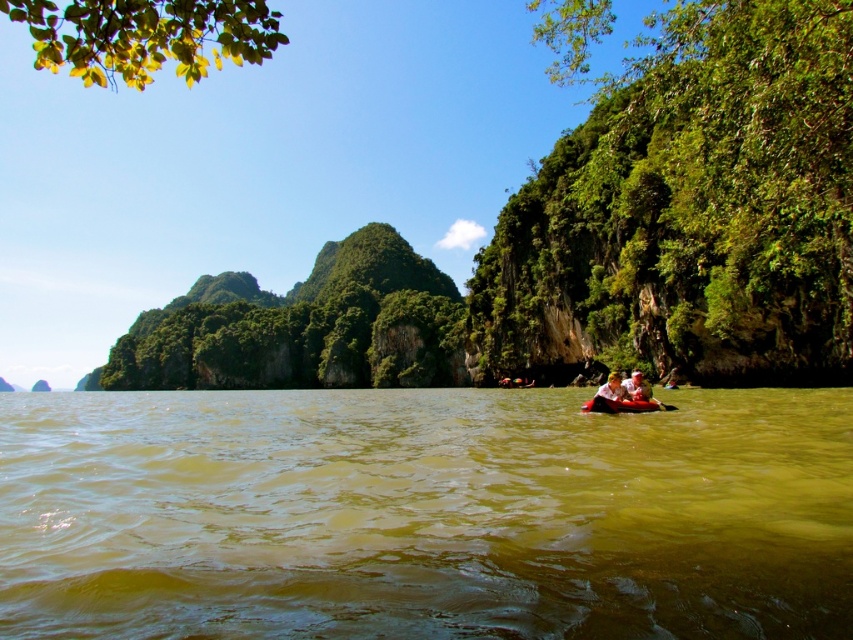
Can you confirm if white cotton shirt at lower right is bigger than smooth red kayak at center?

Actually, white cotton shirt at lower right might be smaller than smooth red kayak at center.

Which is more to the left, white cotton shirt at lower right or smooth red kayak at center?

smooth red kayak at center

Is point (636, 397) more distant than point (606, 388)?

No, (636, 397) is in front of (606, 388).

You are a GUI agent. You are given a task and a screenshot of the screen. Output one action in this format:
    pyautogui.click(x=<x>, y=<y>)
    Task: Click on the white cotton shirt at lower right
    This screenshot has width=853, height=640.
    Given the screenshot: What is the action you would take?
    tap(637, 387)

Which is above, brown murky water at center or white cotton shirt at lower right?

white cotton shirt at lower right is above.

What are the coordinates of `brown murky water at center` in the screenshot? It's located at (424, 515).

What are the coordinates of `brown murky water at center` in the screenshot? It's located at (424, 515).

Does brown murky water at center lie in front of smooth red kayak at center?

That is True.

Is brown murky water at center to the right of smooth red kayak at center from the viewer's perspective?

Incorrect, brown murky water at center is not on the right side of smooth red kayak at center.

Between point (231, 396) and point (616, 394), which one is positioned behind?

Positioned behind is point (231, 396).

Locate an element on the screen. The image size is (853, 640). brown murky water at center is located at coordinates (424, 515).